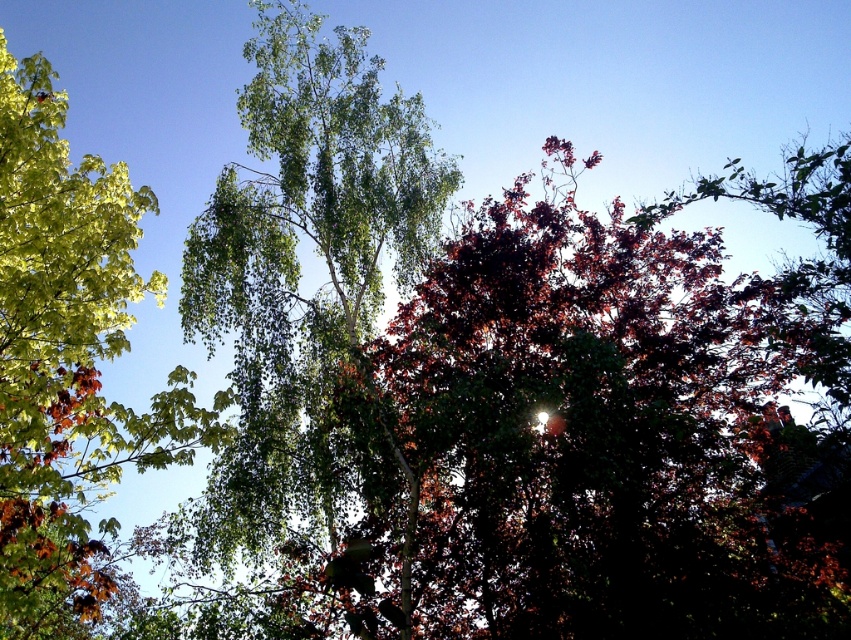
You are a bird looking for a nesting spot. You see the green leafy birch tree at center and the green leafy tree at left. Which tree would provide a higher nesting spot?

The green leafy birch tree at center is much taller than the green leafy tree at left, so it would provide a higher nesting spot.

In the scene shown: You are a bird looking for a place to perch. You see both the green leafy birch tree at center and the green leafy tree at left. Which tree is positioned to the right side of the other?

The green leafy birch tree at center is positioned to the right of the green leafy tree at left.